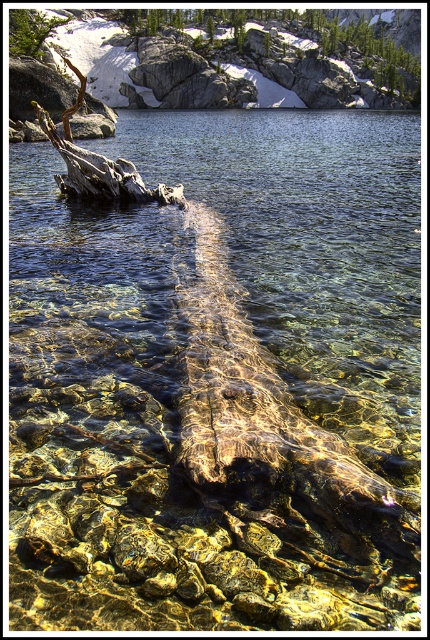
You are an explorer standing at the edge of the water near the large tree trunk. You notice the smooth gray rock at upper center and the green leafy tree at upper left in the distance. Which object is taller from your viewpoint?

The smooth gray rock at upper center is taller than the green leafy tree at upper left from your viewpoint.

You are standing at the edge of the water and want to walk towards the smooth gray rock at upper center. Which direction should you head relative to the green leafy tree at upper left?

You should head to the right of the green leafy tree at upper left because the smooth gray rock at upper center is positioned to the right of it.